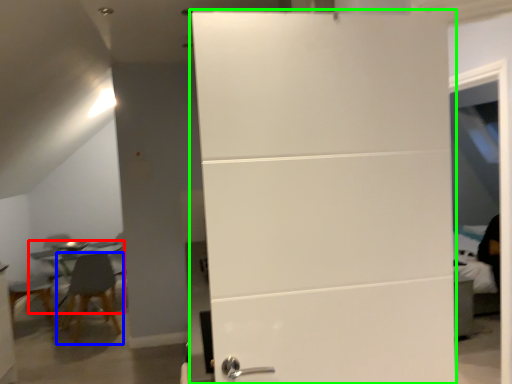
Question: Which object is positioned closest to table (highlighted by a red box)? Select from chair (highlighted by a blue box) and door (highlighted by a green box).

Choices:
 (A) chair
 (B) door

Answer: (A)